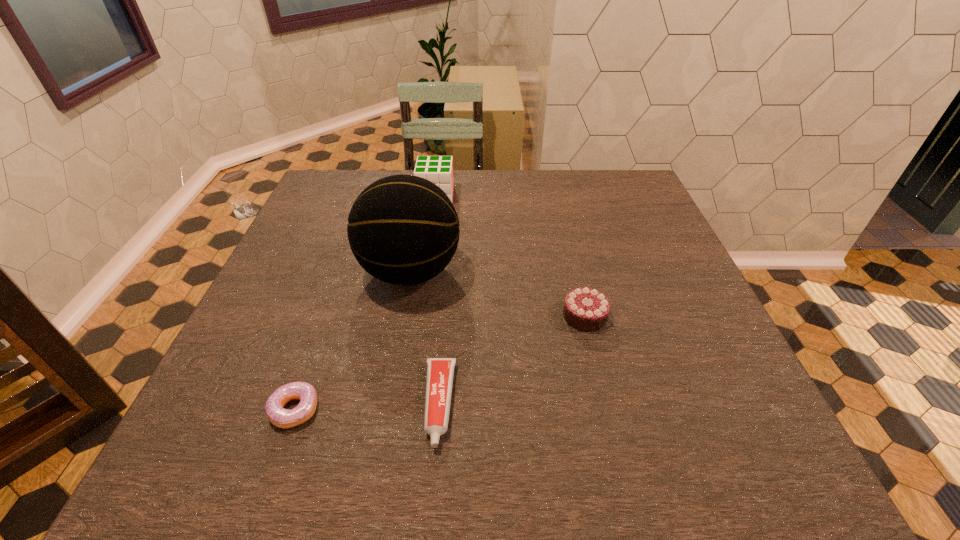
Where is `vacant space located 0.110m on the left of the doughnut`? vacant space located 0.110m on the left of the doughnut is located at coordinates (210, 409).

Find the location of `object present at the far edge`. object present at the far edge is located at coordinates (438, 169).

This screenshot has height=540, width=960. Identify the location of doughnut at the near edge. (283, 418).

Where is `toothpaste present at the near edge`? This screenshot has width=960, height=540. toothpaste present at the near edge is located at coordinates (440, 371).

Locate an element on the screen. The height and width of the screenshot is (540, 960). object that is at the left edge is located at coordinates (283, 418).

The image size is (960, 540). Identify the location of object positioned at the near left corner. (283, 418).

Locate an element on the screen. The height and width of the screenshot is (540, 960). blank space at the far edge of the desktop is located at coordinates (519, 199).

In the image, there is a desktop. At what (x,y) coordinates should I click in order to perform the action: click on vacant region at the left edge. Please return your answer as a coordinate pair (x, y). The width and height of the screenshot is (960, 540). Looking at the image, I should click on (335, 228).

In the image, there is a desktop. Where is `vacant space at the right edge`? vacant space at the right edge is located at coordinates (669, 239).

Locate an element on the screen. The width and height of the screenshot is (960, 540). vacant space at the far left corner of the desktop is located at coordinates (356, 171).